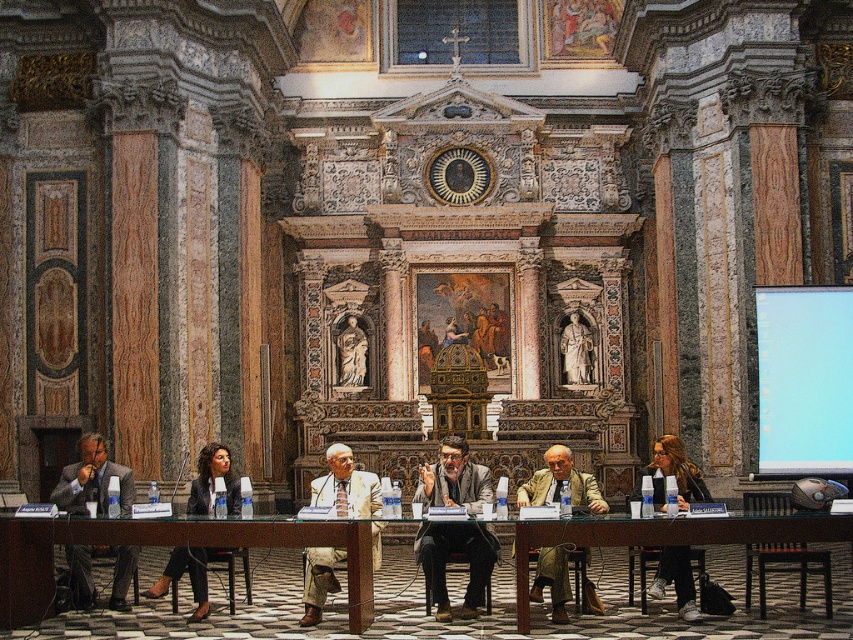
You are organizing a presentation and need to place a 1.2 meter wide laptop on the brown wooden table at center. Considering the size of the matte gray suit at left, can the laptop fit on the table?

The brown wooden table at center might be wider than the matte gray suit at left, so the laptop could potentially fit if the table is indeed wider. However, the exact dimensions are uncertain based on the description provided.

You are one of the participants sitting at the table during the meeting. You need to reach the point labeled point (259, 529) and point (318, 490) on the table. Which point should you move towards first if you want to reach the one closer to you?

Point (259, 529) is in front of point (318, 490), so you should move towards point (259, 529) first since it is closer to your current position at the table.

You are organizing a small workshop and need to seat two participants. You have a wooden polished table at lower right and a black leather pants at lower left available. Which table can accommodate more people comfortably?

The wooden polished table at lower right has a larger width than the black leather pants at lower left, so it can accommodate more people comfortably.